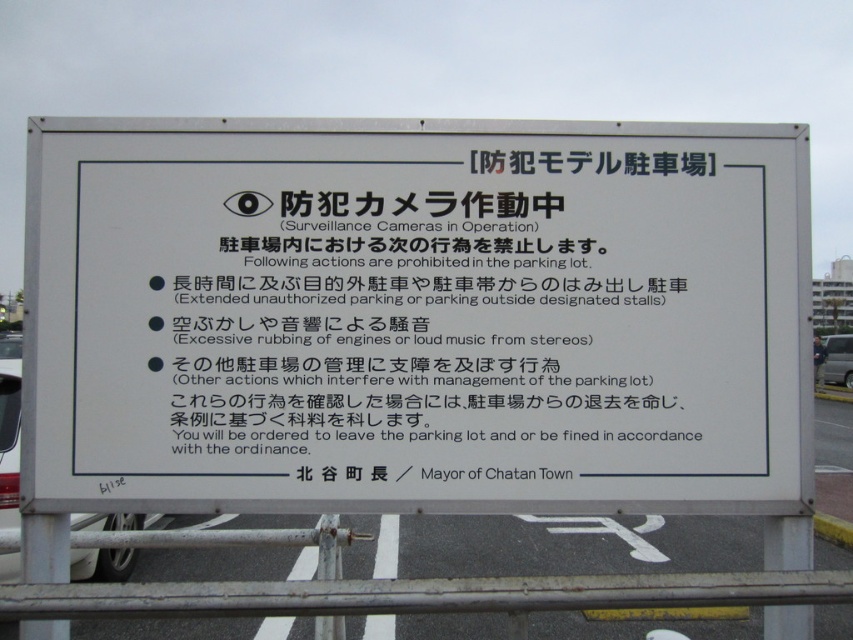
You are standing in the parking lot and want to locate the white paper sign at center. Where should you look?

You should look at point (x=416, y=316) to find the white paper sign at center.

You are standing in front of the signboard in the parking lot. You notice two points marked on the signboard at coordinates point (91, 520) and point (845, 381). Which point is closer to you?

Point (91, 520) is closer to the viewer than point (845, 381).